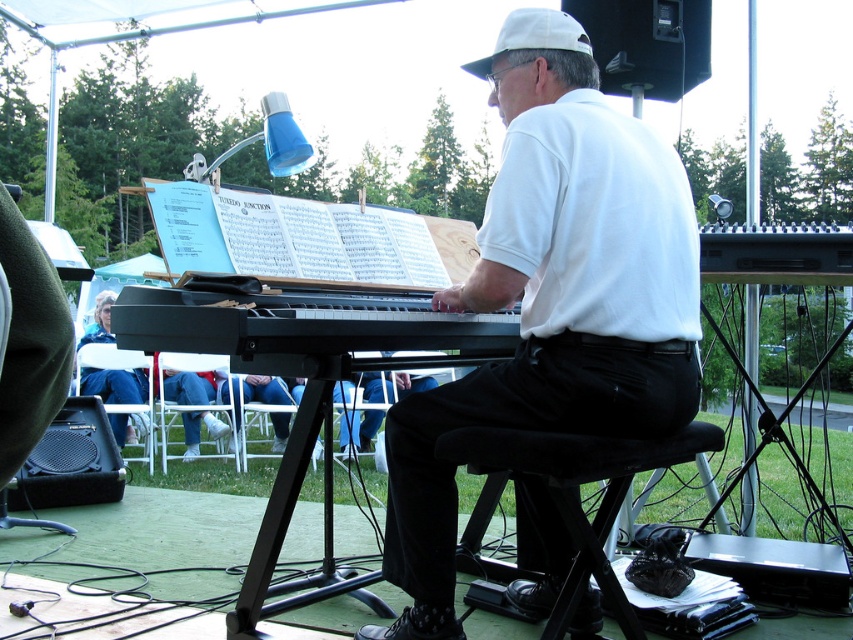
Question: Which object appears farthest from the camera in this image?

Choices:
 (A) black fabric stool at lower center
 (B) white matte shirt at center

Answer: (B)

Question: In this image, where is black matte keyboard at center located relative to black fabric stool at lower center?

Choices:
 (A) above
 (B) below

Answer: (A)

Question: Estimate the real-world distances between objects in this image. Which object is closer to the black matte keyboard at center?

Choices:
 (A) black fabric stool at lower center
 (B) white matte shirt at center

Answer: (B)

Question: Is white matte shirt at center smaller than black matte keyboard at center?

Choices:
 (A) no
 (B) yes

Answer: (A)

Question: Is white matte shirt at center thinner than black matte keyboard at center?

Choices:
 (A) yes
 (B) no

Answer: (A)

Question: Which object appears farthest from the camera in this image?

Choices:
 (A) black fabric stool at lower center
 (B) white matte shirt at center

Answer: (B)